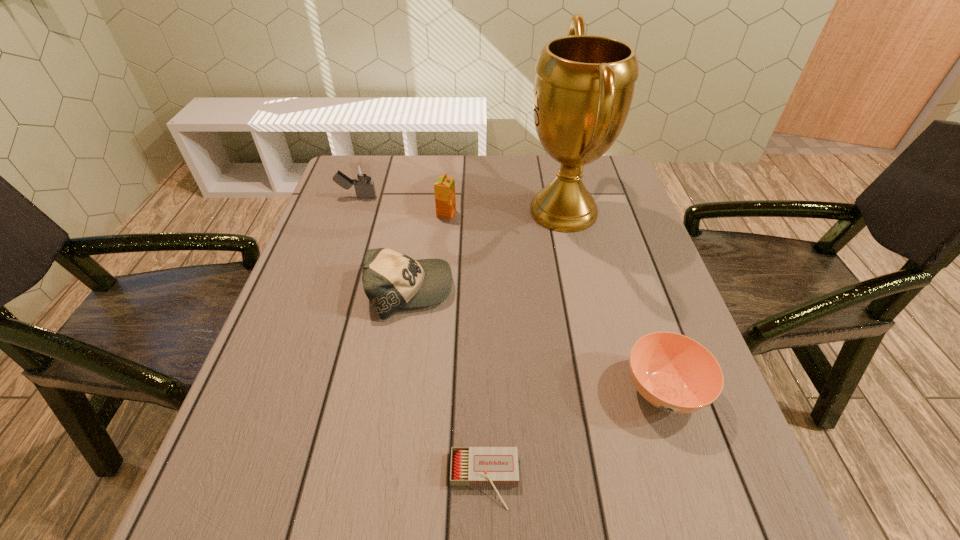
Identify the location of free spot that satisfies the following two spatial constraints: 1. on the front side of the soup bowl; 2. on the left side of the igniter. This screenshot has height=540, width=960. (291, 390).